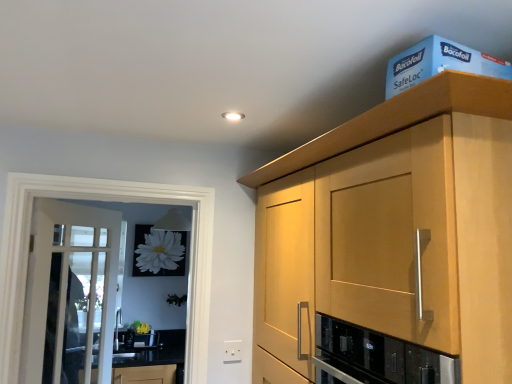
Question: Based on their positions, is white plastic electric outlet at lower center located to the left or right of black granite countertop at lower left?

Choices:
 (A) right
 (B) left

Answer: (A)

Question: From a real-world perspective, is white plastic electric outlet at lower center physically located above or below black granite countertop at lower left?

Choices:
 (A) below
 (B) above

Answer: (B)

Question: Which object is the closest to the light wood cabinet at upper right?

Choices:
 (A) black granite countertop at lower left
 (B) blue cardboard box at upper right
 (C) white plastic electric outlet at lower center
 (D) white glass door at left
 (E) clear glass screen door at left

Answer: (B)

Question: Estimate the real-world distances between objects in this image. Which object is closer to the light wood cabinet at upper right?

Choices:
 (A) black glass oven at center
 (B) white plastic electric outlet at lower center
 (C) blue cardboard box at upper right
 (D) clear glass screen door at left
 (E) black granite countertop at lower left

Answer: (C)